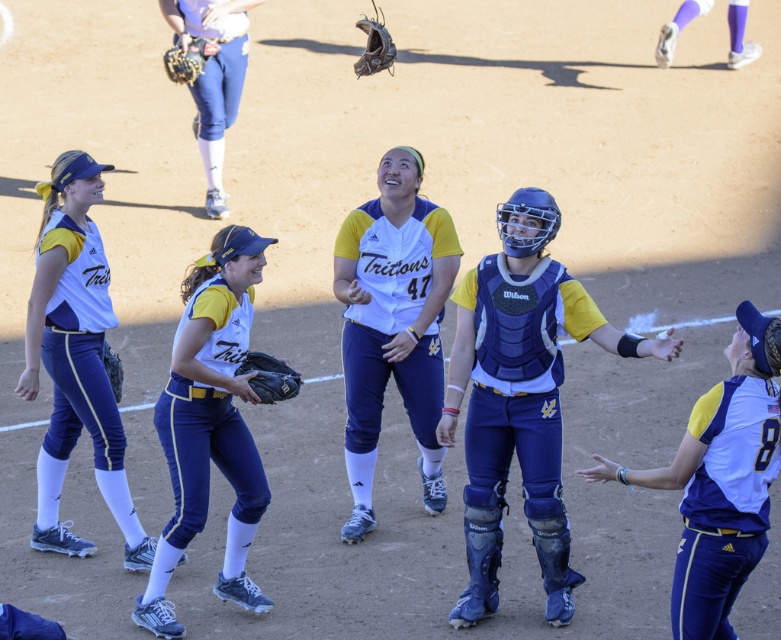
You are a photographer at the softball game. You want to capture a photo of the white matte jersey at center and the dark brown leather glove at center. Based on their positions, which object should you focus on first to ensure both are in frame?

The white matte jersey at center is above the dark brown leather glove at center, so you should focus on the white matte jersey at center first to ensure both are in frame.

You are a softball coach observing the game. You notice the blue padded catcher at center and the dark brown leather glove at center. Which object is positioned lower in the image?

The blue padded catcher at center is positioned below the dark brown leather glove at center, so the blue padded catcher at center is lower in the image.

You are a photographer at the softball game and need to capture a clear shot of both the white matte jersey at center and the dark brown leather glove at center. Since you want both items to be visible in the frame, which object should you focus on first to ensure proper focus, considering their sizes?

The white matte jersey at center is bigger than the dark brown leather glove at center, so you should focus on the white matte jersey at center first to ensure it is in focus, as larger objects often require more precise focus adjustments.